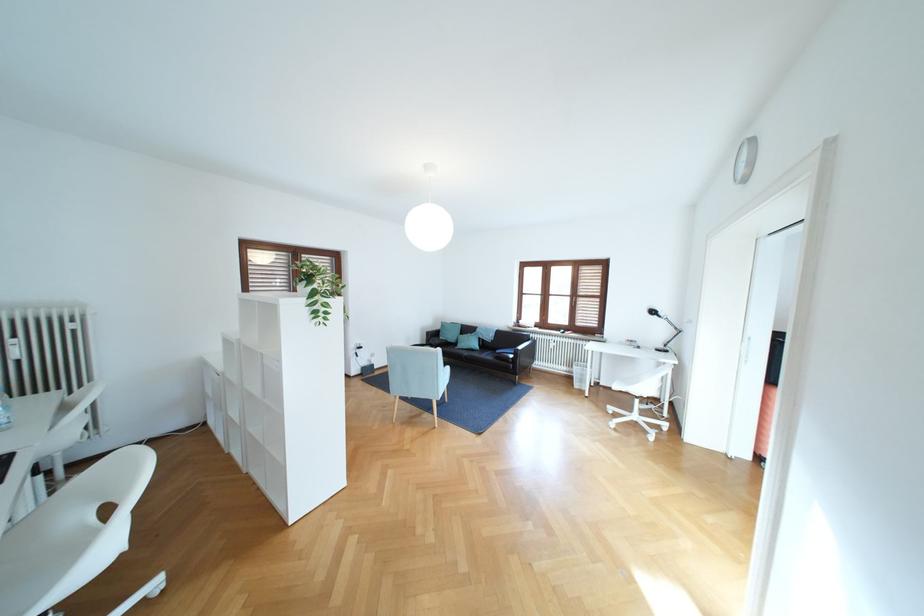
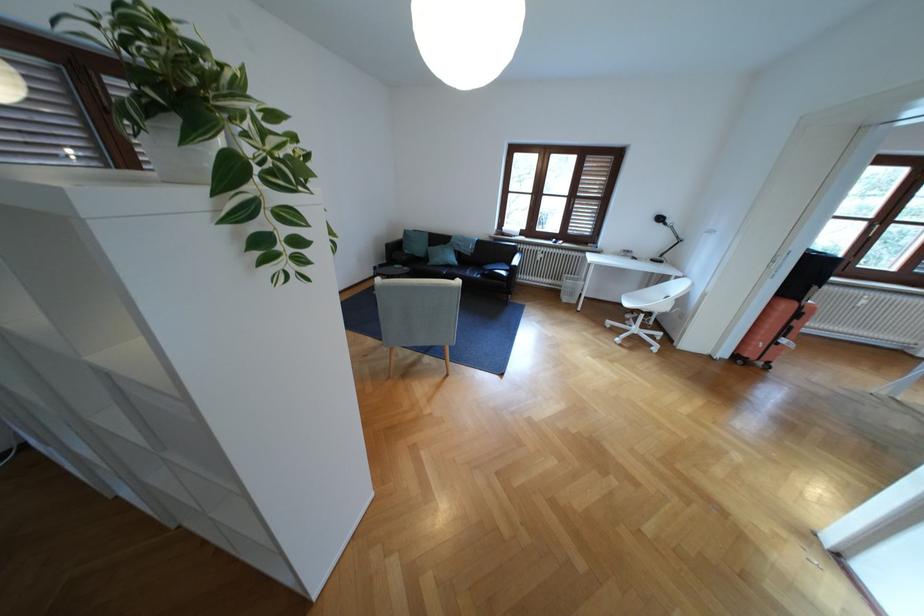
In the second image, find the point that corresponds to point (578, 371) in the first image.

(563, 285)